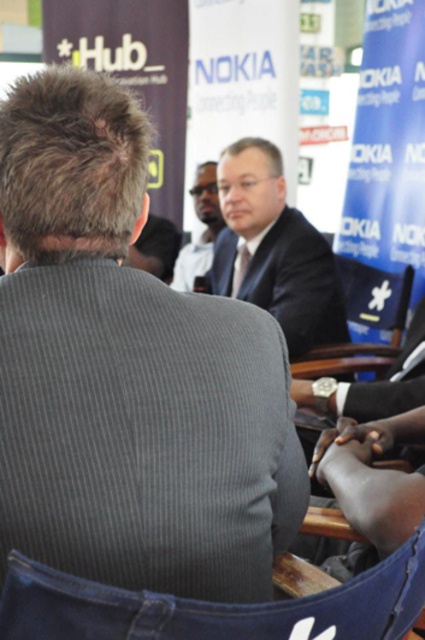
The width and height of the screenshot is (425, 640). What are the coordinates of `gray ribbed shirt at center` in the screenshot? It's located at (127, 371).

Does gray ribbed shirt at center lie in front of dark suit at center?

Yes, gray ribbed shirt at center is in front of dark suit at center.

Is point (87, 141) in front of point (277, 236)?

Yes, it is.

Find the location of a particular element. The width and height of the screenshot is (425, 640). gray ribbed shirt at center is located at coordinates (127, 371).

Can you confirm if gray ribbed shirt at center is wider than smooth skin face at center?

Indeed, gray ribbed shirt at center has a greater width compared to smooth skin face at center.

Can you confirm if gray ribbed shirt at center is thinner than smooth skin face at center?

No.

Is point (93, 477) positioned after point (212, 220)?

No, it is not.

Where is `gray ribbed shirt at center`? gray ribbed shirt at center is located at coordinates (127, 371).

Which is more to the left, dark suit at center or smooth skin face at center?

From the viewer's perspective, smooth skin face at center appears more on the left side.

Is point (275, 262) in front of point (204, 236)?

Yes, it is in front of point (204, 236).

Locate an element on the screen. The width and height of the screenshot is (425, 640). dark suit at center is located at coordinates (272, 250).